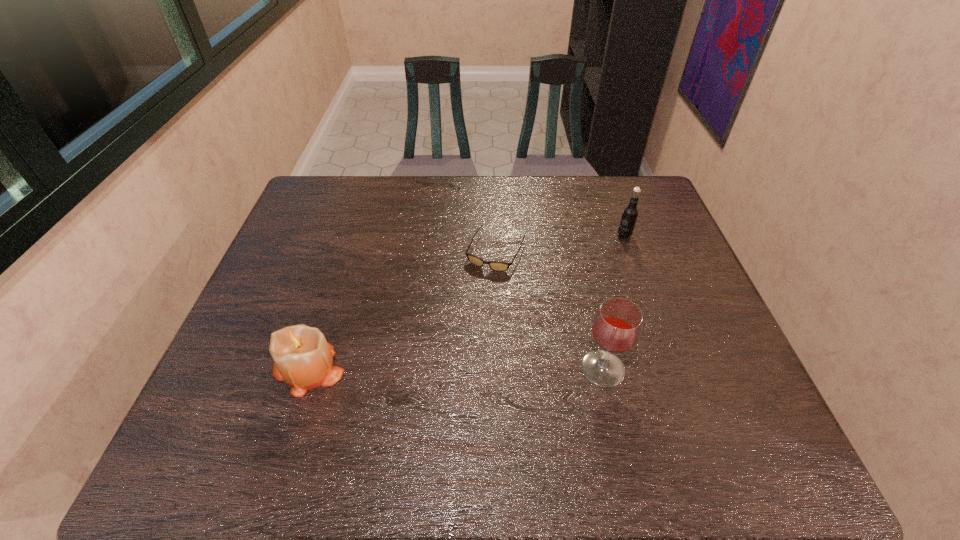
Locate an element on the screen. candle is located at coordinates (303, 358).

Identify the location of the third object from left to right. (616, 328).

You are a GUI agent. You are given a task and a screenshot of the screen. Output one action in this format:
    pyautogui.click(x=<x>, y=<y>)
    Task: Click on the sunglasses
    Image resolution: width=960 pixels, height=540 pixels.
    Given the screenshot: What is the action you would take?
    pyautogui.click(x=494, y=265)

Locate an element on the screen. the shortest object is located at coordinates (494, 265).

Identify the location of the rightmost object. The height and width of the screenshot is (540, 960). (629, 216).

Find the location of a particular element. free space located on the right of the leftmost object is located at coordinates (496, 369).

You are a GUI agent. You are given a task and a screenshot of the screen. Output one action in this format:
    pyautogui.click(x=<x>, y=<y>)
    Task: Click on the vacant space located on the left of the third object from left to right
    
    Given the screenshot: What is the action you would take?
    pyautogui.click(x=515, y=368)

This screenshot has height=540, width=960. I want to click on free space located 0.270m on the front-facing side of the sunglasses, so click(447, 347).

Where is `vacant region located 0.300m on the front-facing side of the sunglasses`? The height and width of the screenshot is (540, 960). vacant region located 0.300m on the front-facing side of the sunglasses is located at coordinates (443, 357).

This screenshot has width=960, height=540. Identify the location of vacant region located on the front-facing side of the sunglasses. (441, 361).